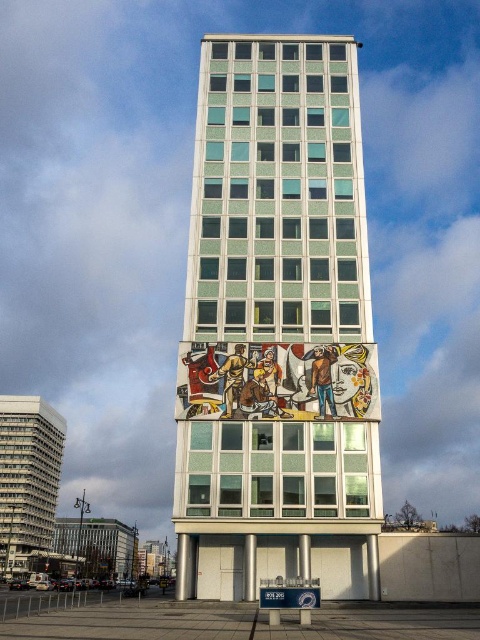
Between white glossy building at center and matte gray building at left, which one appears on the left side from the viewer's perspective?

From the viewer's perspective, matte gray building at left appears more on the left side.

Is white glossy building at center taller than matte gray building at left?

Yes.

In order to click on white glossy building at center in this screenshot , I will do pyautogui.click(x=277, y=326).